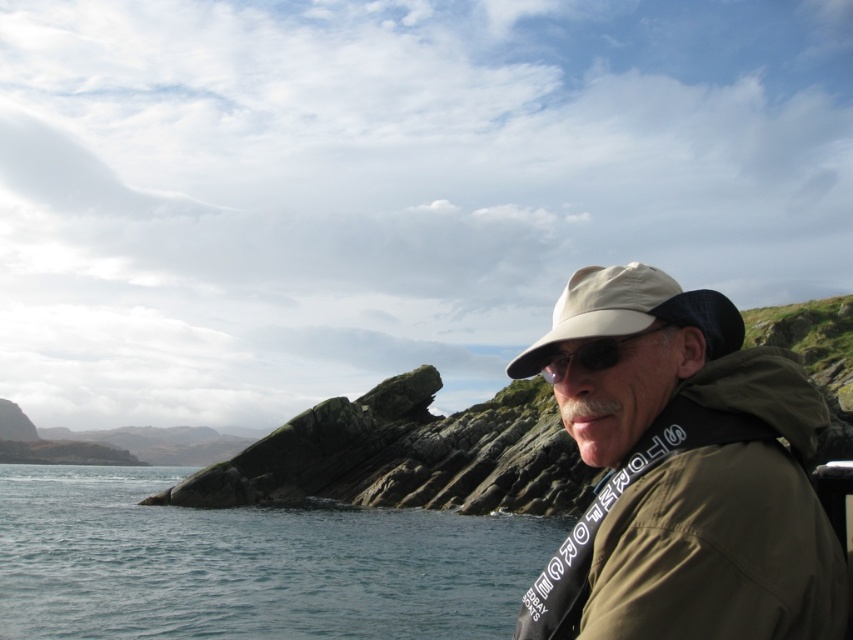
Which is in front, point (683, 538) or point (693, 308)?

Point (683, 538) is more forward.

Can you confirm if khaki fabric cap at upper right is smaller than beige fabric baseball cap at center?

Incorrect, khaki fabric cap at upper right is not smaller in size than beige fabric baseball cap at center.

Locate an element on the screen. The height and width of the screenshot is (640, 853). khaki fabric cap at upper right is located at coordinates coord(682,472).

Which is in front, point (631, 278) or point (126, 528)?

Positioned in front is point (631, 278).

Does khaki fabric cap at upper right have a greater width compared to blue water at lower left?

In fact, khaki fabric cap at upper right might be narrower than blue water at lower left.

At what (x,y) coordinates should I click in order to perform the action: click on khaki fabric cap at upper right. Please return your answer as a coordinate pair (x, y). The image size is (853, 640). Looking at the image, I should click on (682, 472).

The width and height of the screenshot is (853, 640). I want to click on khaki fabric cap at upper right, so click(x=682, y=472).

Between point (357, 522) and point (601, 358), which one is positioned behind?

The point (357, 522) is more distant.

Can you confirm if blue water at lower left is bigger than black reflective sunglasses at center?

Yes, blue water at lower left is bigger than black reflective sunglasses at center.

Which is in front, point (264, 528) or point (547, 381)?

Point (547, 381)

The height and width of the screenshot is (640, 853). Find the location of `blue water at lower left`. blue water at lower left is located at coordinates (248, 564).